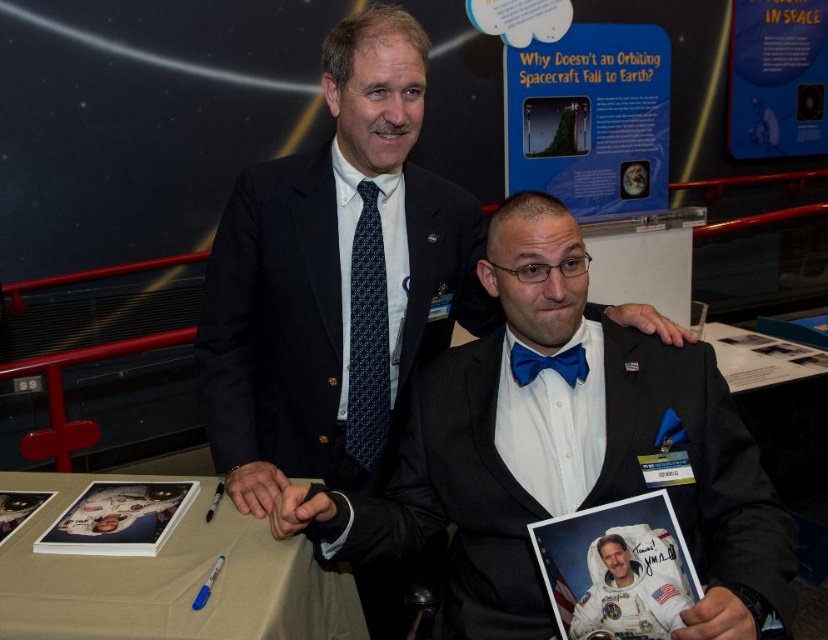
You are at an event and need to take a photo of the blue satin bow tie at center without moving the black satin business suit at center. Is the bow tie visible from your current position?

The black satin business suit at center is closer to the viewer than the blue satin bow tie at center, so the bow tie may be partially or fully obscured by the suit, making it difficult to capture in the photo without moving the suit.